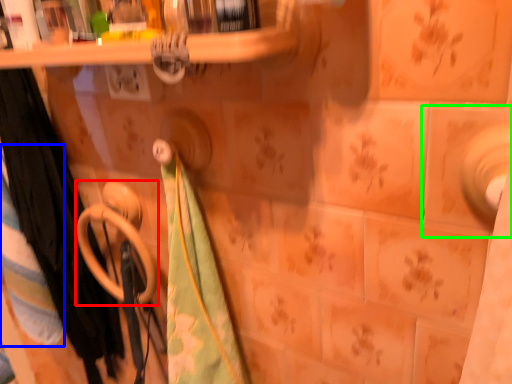
Question: Based on their relative distances, which object is nearer to towel rack (highlighted by a red box)? Choose from beach towel (highlighted by a blue box) and ceramic tile (highlighted by a green box).

Choices:
 (A) beach towel
 (B) ceramic tile

Answer: (A)